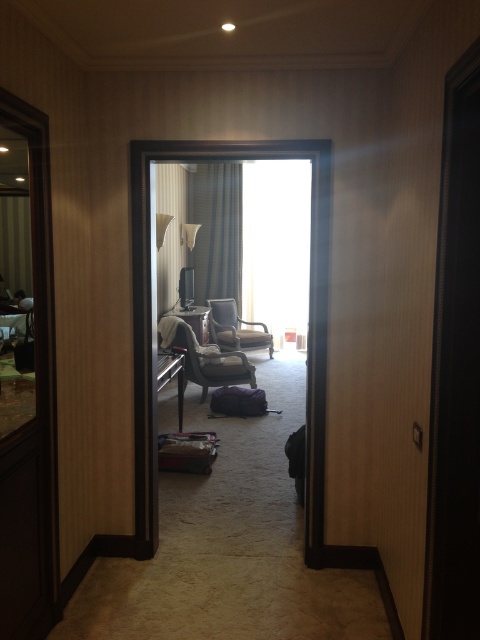
You are a hotel guest trying to locate the exit. You see the black wood door at right and the matte gray curtain at center. Which object is positioned lower in the scene?

The black wood door at right is positioned lower than the matte gray curtain at center.

You are a hotel guest who wants to adjust the lighting in your room. You have the option to fully open or close the matte gray curtain at center. Considering the size of the velvet gray armchair at left, will closing the curtain block the view from the armchair to the window?

The matte gray curtain at center is larger in size compared to the velvet gray armchair at left. Closing it may block the view from the velvet gray armchair at left to the window depending on how it is positioned, but since the curtain is larger, it could potentially cover more of the window area, possibly obstructing the view.